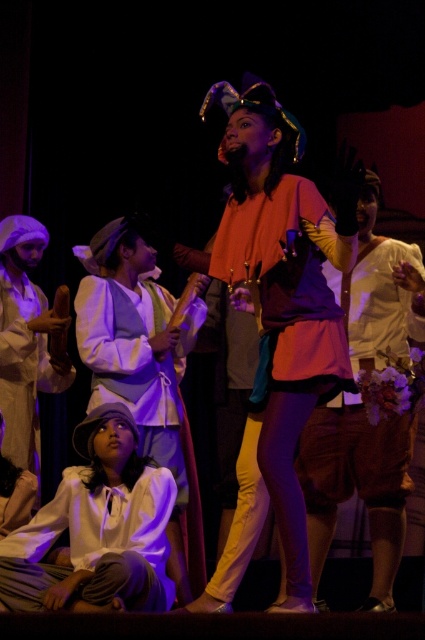
You are an audience member sitting in the front row of the theater. You notice two performers on stage wearing a matte orange blouse at center and a white cotton shirt at lower left. Which performer is positioned higher in the stage setup?

The matte orange blouse at center is positioned higher than the white cotton shirt at lower left because it is above it.

In the theatrical scene, you notice two performers wearing a matte white blouse at center and a white cotton shirt at lower left. Which one has a larger clothing size?

The matte white blouse at center has a larger size compared to the white cotton shirt at lower left.

You are a stagehand in a theater. You need to place a small prop on the stage. The prop must be placed exactly at point (25, 340). Where should you place the prop? Please answer using the objects in the scene.

You should place the prop on the white cotton hat at lower left because the point (25, 340) is located there.